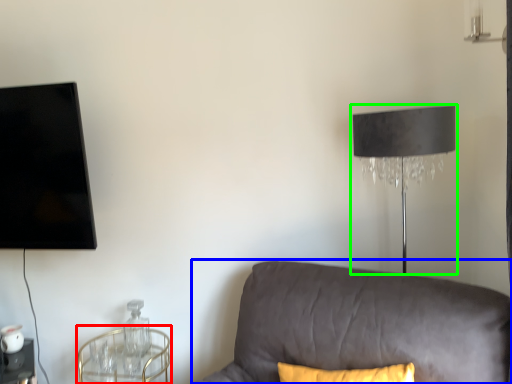
Question: Estimate the real-world distances between objects in this image. Which object is closer to round table (highlighted by a red box), studio couch (highlighted by a blue box) or lamp (highlighted by a green box)?

Choices:
 (A) studio couch
 (B) lamp

Answer: (A)